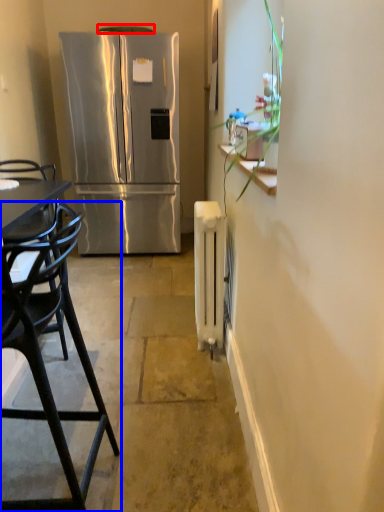
Question: Which object is further to the camera taking this photo, exhaust hood (highlighted by a red box) or chair (highlighted by a blue box)?

Choices:
 (A) exhaust hood
 (B) chair

Answer: (A)